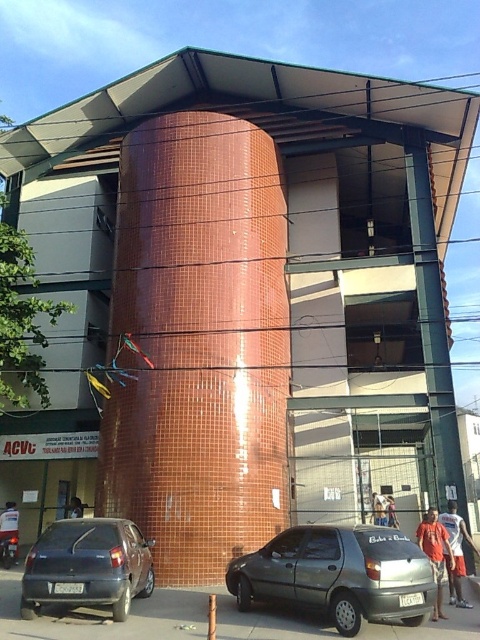
You are a driver who needs to park your car in a parking lot. You see a metallic gray hatchback at lower center and a matte gray car at lower left. Which car is blocking the parking spot?

The metallic gray hatchback at lower center is positioned under the matte gray car at lower left, so the matte gray car at lower left is blocking the parking spot.

You are standing in front of the modern building and want to park your matte gray car at lower left on the gray asphalt pavement at lower center. Can you safely park your car there?

The gray asphalt pavement at lower center has a lesser height compared to the matte gray car at lower left, which means the pavement is lower than the car. This might make parking difficult due to the elevation difference. It is advisable to check the slope or elevation before proceeding to park the matte gray car at lower left on the gray asphalt pavement at lower center.

You are a parking attendant who needs to fit both the metallic gray hatchback at lower center and the matte gray car at lower left into a parking spot that can only accommodate vehicles up to the size of the smaller car. Which car should you prioritize parking first?

The metallic gray hatchback at lower center is larger than the matte gray car at lower left. Therefore, you should prioritize parking the matte gray car at lower left first since it is smaller and will fit within the parking spot size limit.